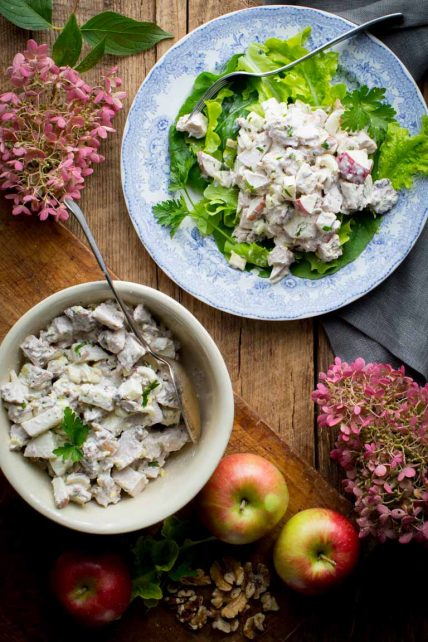
This screenshot has width=428, height=642. Identify the location of spoon. (187, 404).